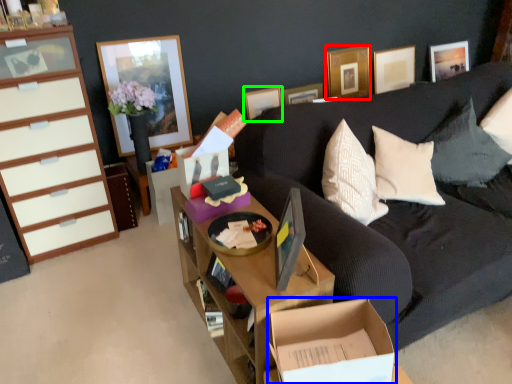
Question: Which object is positioned farthest from picture frame (highlighted by a red box)? Select from cardboard box (highlighted by a blue box) and picture frame (highlighted by a green box).

Choices:
 (A) cardboard box
 (B) picture frame

Answer: (A)